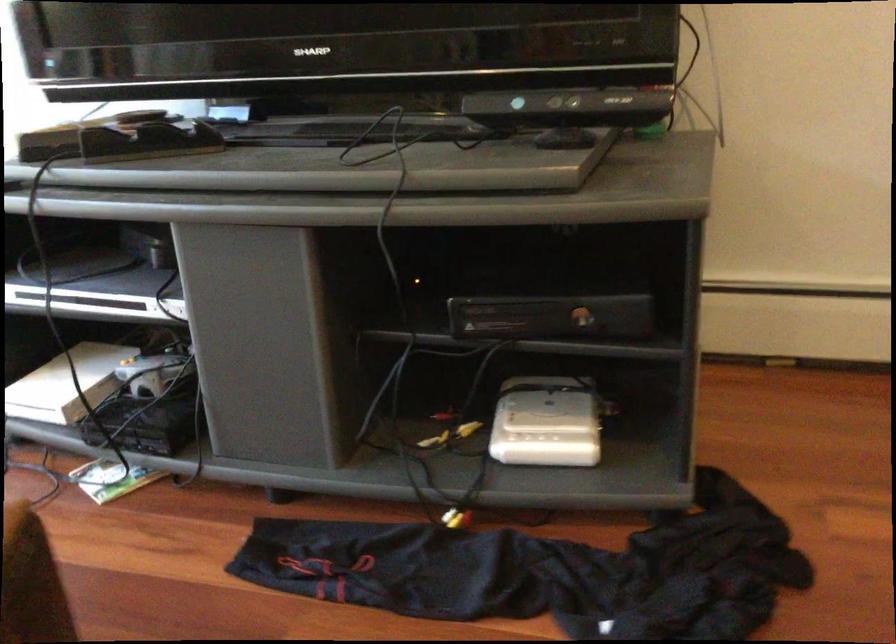
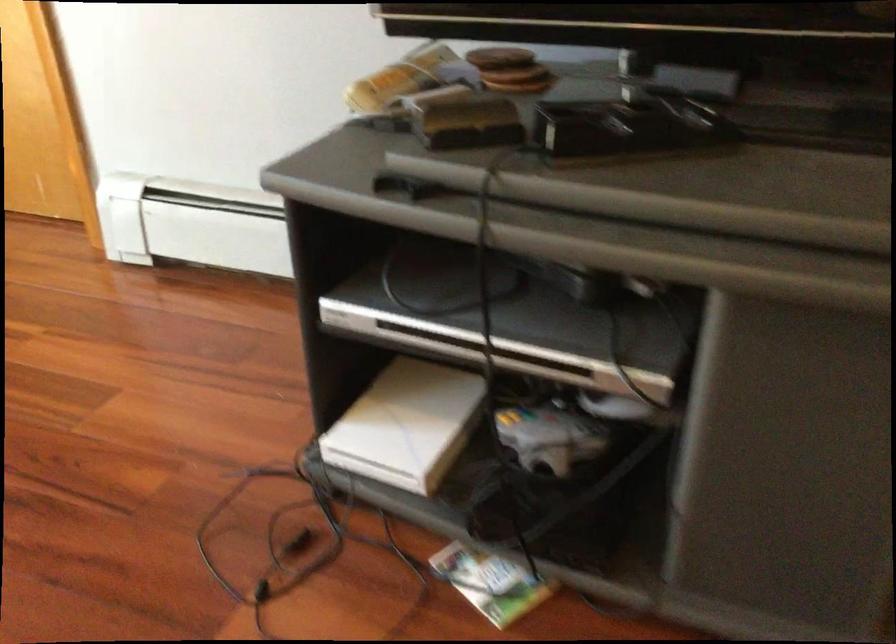
The point at (x=143, y=140) is marked in the first image. Where is the corresponding point in the second image?

(627, 126)